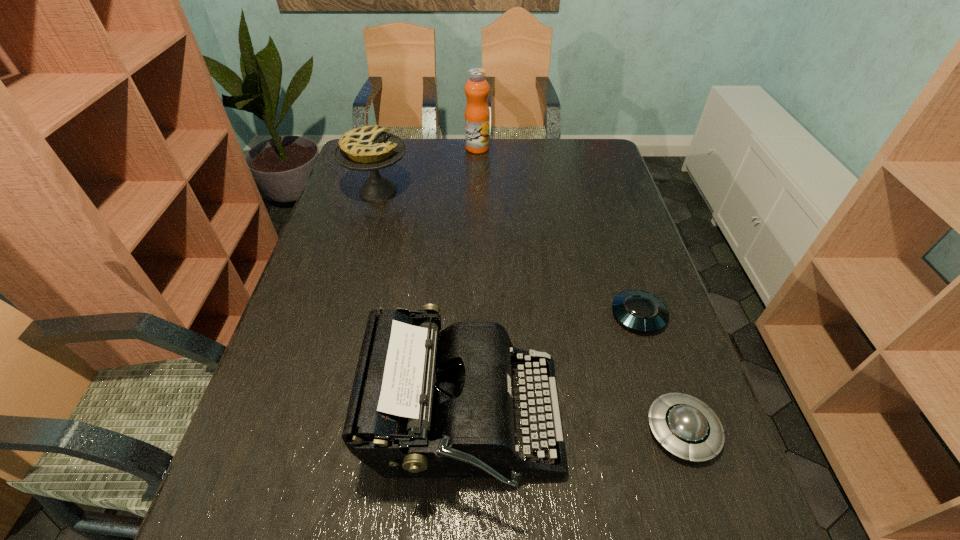
Where is `the farthest object`? The width and height of the screenshot is (960, 540). the farthest object is located at coordinates (477, 114).

You are a GUI agent. You are given a task and a screenshot of the screen. Output one action in this format:
    pyautogui.click(x=<x>, y=<y>)
    Task: Click on the tallest object
    This screenshot has width=960, height=540.
    Given the screenshot: What is the action you would take?
    pyautogui.click(x=477, y=114)

Identify the location of the fourth nearest object. This screenshot has width=960, height=540. 369,148.

You are a GUI agent. You are given a task and a screenshot of the screen. Output one action in this format:
    pyautogui.click(x=<x>, y=<y>)
    Task: Click on the leftmost object
    Image resolution: width=960 pixels, height=540 pixels.
    Given the screenshot: What is the action you would take?
    pyautogui.click(x=369, y=148)

Locate an element on the screen. typewriter is located at coordinates [424, 404].

You are a GUI agent. You are given a task and a screenshot of the screen. Output one action in this format:
    pyautogui.click(x=<x>, y=<y>)
    Task: Click on the taller saucer
    Image resolution: width=960 pixels, height=540 pixels.
    Given the screenshot: What is the action you would take?
    687,427

I want to click on the nearer saucer, so click(x=687, y=427).

Where is `the shortest object`? Image resolution: width=960 pixels, height=540 pixels. the shortest object is located at coordinates (638, 310).

Where is `the farther saucer`? The width and height of the screenshot is (960, 540). the farther saucer is located at coordinates pos(638,310).

Find the location of `vacant space located 0.350m on the left of the fruit juice`. vacant space located 0.350m on the left of the fruit juice is located at coordinates (371, 148).